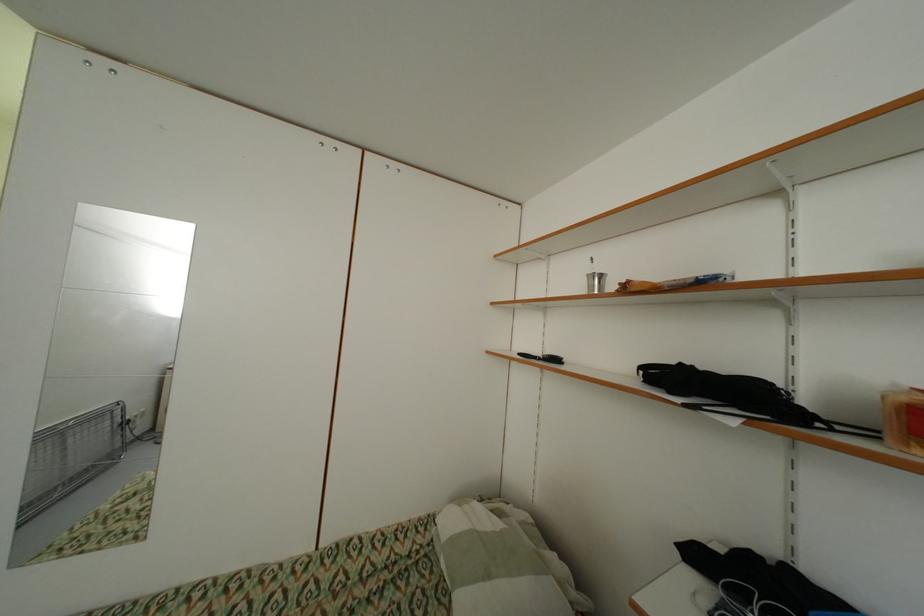
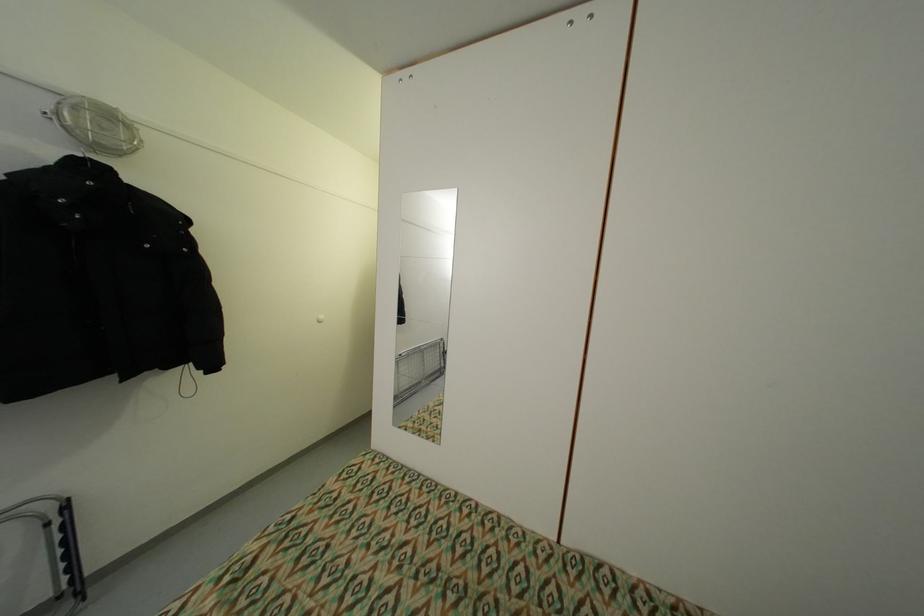
Question: The camera is either moving clockwise (left) or counter-clockwise (right) around the object. The first image is from the beginning of the video and the second image is from the end. Is the camera moving left or right when shooting the video?

Choices:
 (A) Left
 (B) Right

Answer: (B)